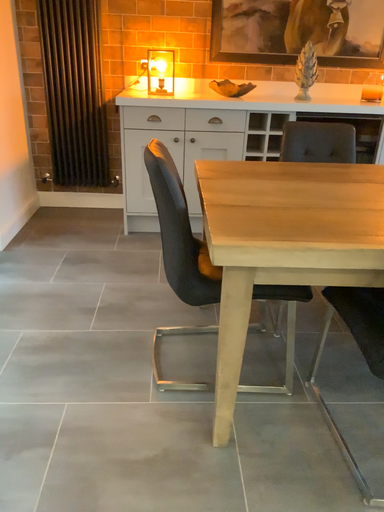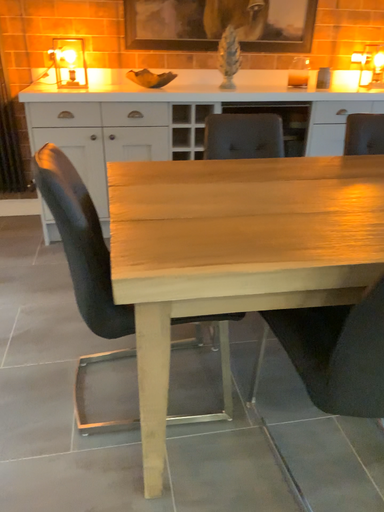
Question: Which way did the camera rotate in the video?

Choices:
 (A) rotated left
 (B) rotated right

Answer: (B)